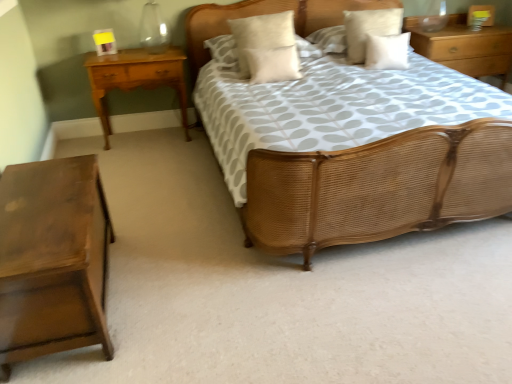
I want to click on vacant space situated above dark brown wood nightstand at lower left, acting as the 3th nightstand starting from the top (from a real-world perspective), so click(x=45, y=199).